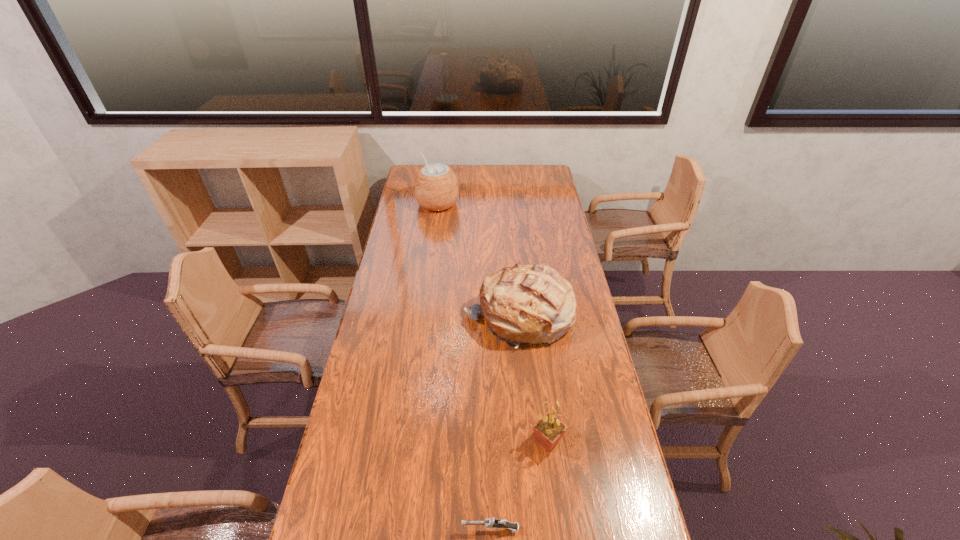
This screenshot has height=540, width=960. Identify the location of vacant region at the right edge of the desktop. (592, 408).

Locate an element on the screen. The width and height of the screenshot is (960, 540). vacant area that lies between the second nearest object and the bread is located at coordinates (533, 378).

The height and width of the screenshot is (540, 960). I want to click on vacant region between the second tallest object and the farthest object, so click(x=478, y=260).

The width and height of the screenshot is (960, 540). I want to click on unoccupied area between the gun and the coconut, so click(464, 367).

Locate an element on the screen. This screenshot has height=540, width=960. free point between the tallest object and the shortest object is located at coordinates (464, 367).

This screenshot has height=540, width=960. In order to click on vacant point located between the bread and the nearest object in this screenshot , I will do `click(505, 422)`.

Find the location of `vacant area that lies between the second tallest object and the shortest object`. vacant area that lies between the second tallest object and the shortest object is located at coordinates (505, 422).

Choose which object is the nearest neighbor to the third shortest object. Please provide its 2D coordinates. Your answer should be formatted as a tuple, i.e. [(x, y)], where the tuple contains the x and y coordinates of a point satisfying the conditions above.

[(548, 431)]

The height and width of the screenshot is (540, 960). Identify the location of object that can be found as the second closest to the bread. (436, 188).

Image resolution: width=960 pixels, height=540 pixels. I want to click on free space that satisfies the following two spatial constraints: 1. on the front side of the bread; 2. aimed along the barrel of the shortest object, so click(538, 529).